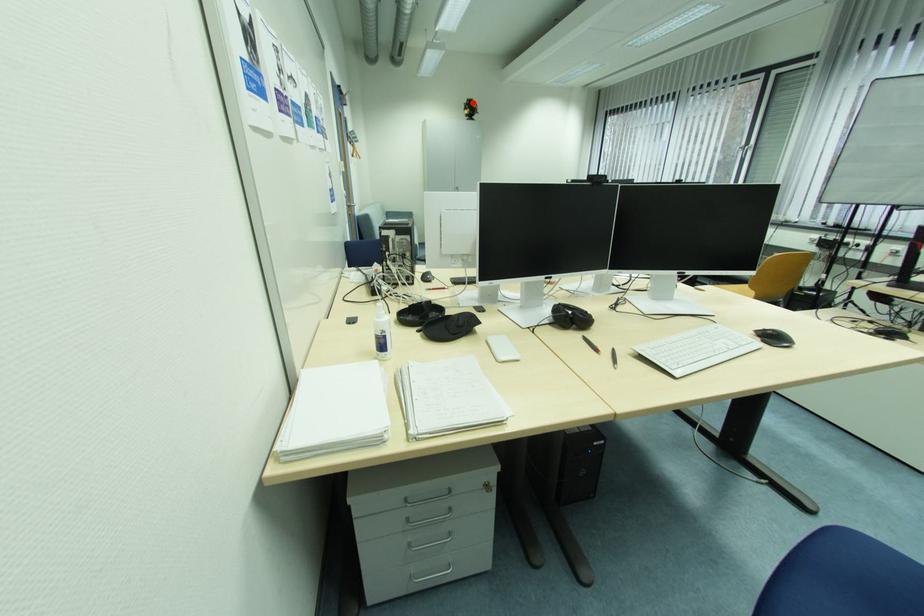
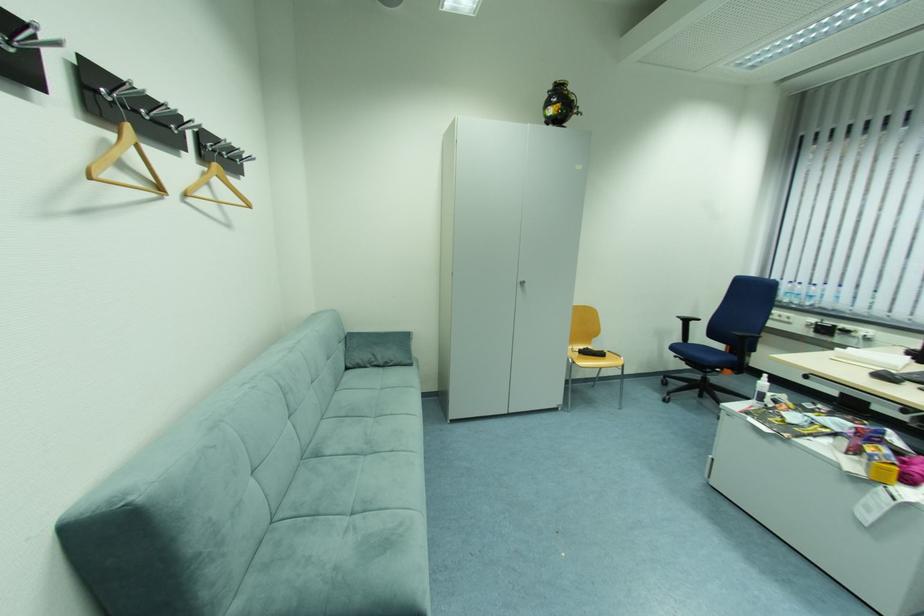
The point at the highlighted location is marked in the first image. Where is the corresponding point in the second image?

(558, 87)